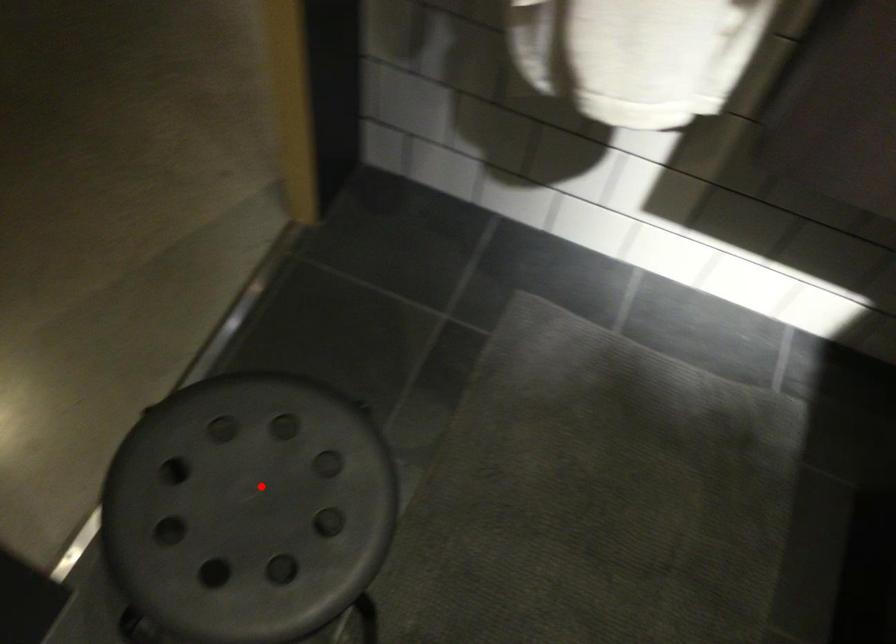
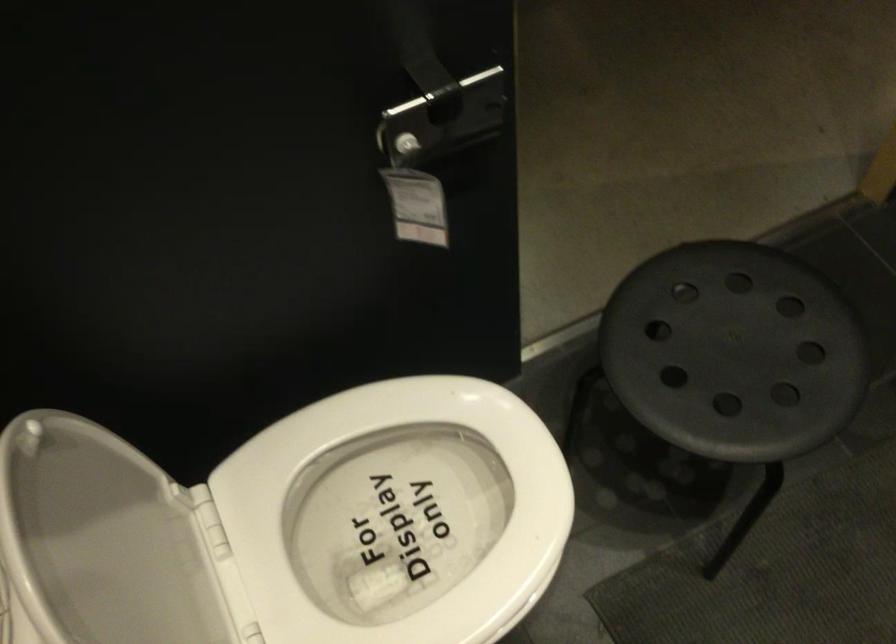
The point at the highlighted location is marked in the first image. Where is the corresponding point in the second image?

(734, 351)